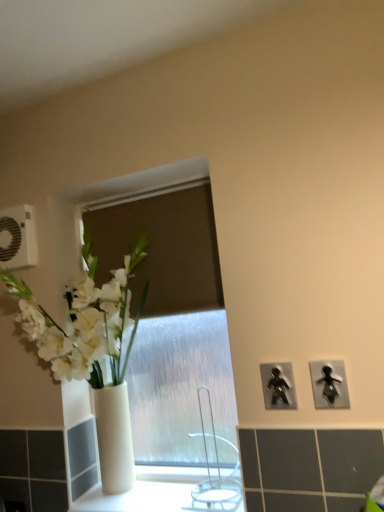
Question: From a real-world perspective, is silver metallic faucet at center physically below black plastic figure at right, marked as the second electric outlet in a back-to-front arrangement?

Choices:
 (A) yes
 (B) no

Answer: (A)

Question: Could black plastic figure at right, the first electric outlet in the bottom-to-top sequence, be considered to be inside silver metallic faucet at center?

Choices:
 (A) yes
 (B) no

Answer: (B)

Question: Does silver metallic faucet at center have a greater width compared to black plastic figure at right, the third electric outlet positioned from the top?

Choices:
 (A) yes
 (B) no

Answer: (A)

Question: Does silver metallic faucet at center come behind black plastic figure at right, the 2th electric outlet in the left-to-right sequence?

Choices:
 (A) no
 (B) yes

Answer: (B)

Question: Does silver metallic faucet at center appear on the left side of black plastic figure at right, the third electric outlet positioned from the top?

Choices:
 (A) yes
 (B) no

Answer: (A)

Question: Can you confirm if silver metallic faucet at center is smaller than black plastic figure at right, the third electric outlet positioned from the top?

Choices:
 (A) no
 (B) yes

Answer: (A)

Question: Is white plastic electric outlet at upper left, arranged as the 1th electric outlet when viewed from the left, in front of black plastic figure at right, the 2th electric outlet in the left-to-right sequence?

Choices:
 (A) yes
 (B) no

Answer: (B)

Question: Is white plastic electric outlet at upper left, which is counted as the 1th electric outlet, starting from the top, facing away from black plastic figure at right, marked as the second electric outlet in a back-to-front arrangement?

Choices:
 (A) no
 (B) yes

Answer: (A)

Question: Can you confirm if white plastic electric outlet at upper left, arranged as the 1th electric outlet when viewed from the left, is smaller than black plastic figure at right, marked as the second electric outlet in a back-to-front arrangement?

Choices:
 (A) yes
 (B) no

Answer: (B)

Question: From a real-world perspective, is white plastic electric outlet at upper left, acting as the third electric outlet starting from the front, located beneath black plastic figure at right, the 2th electric outlet when ordered from right to left?

Choices:
 (A) yes
 (B) no

Answer: (B)

Question: Considering the relative sizes of white plastic electric outlet at upper left, which is counted as the 1th electric outlet, starting from the top, and black plastic figure at right, the 2th electric outlet when ordered from right to left, in the image provided, is white plastic electric outlet at upper left, which is counted as the 1th electric outlet, starting from the top, wider than black plastic figure at right, the 2th electric outlet when ordered from right to left,?

Choices:
 (A) yes
 (B) no

Answer: (A)

Question: Is white plastic electric outlet at upper left, the 3th electric outlet from the bottom, at the left side of black plastic figure at right, the 2th electric outlet when ordered from right to left?

Choices:
 (A) yes
 (B) no

Answer: (A)

Question: Considering the relative sizes of black plastic figure at right, marked as the second electric outlet in a back-to-front arrangement, and white glossy vase at left in the image provided, is black plastic figure at right, marked as the second electric outlet in a back-to-front arrangement, wider than white glossy vase at left?

Choices:
 (A) yes
 (B) no

Answer: (B)